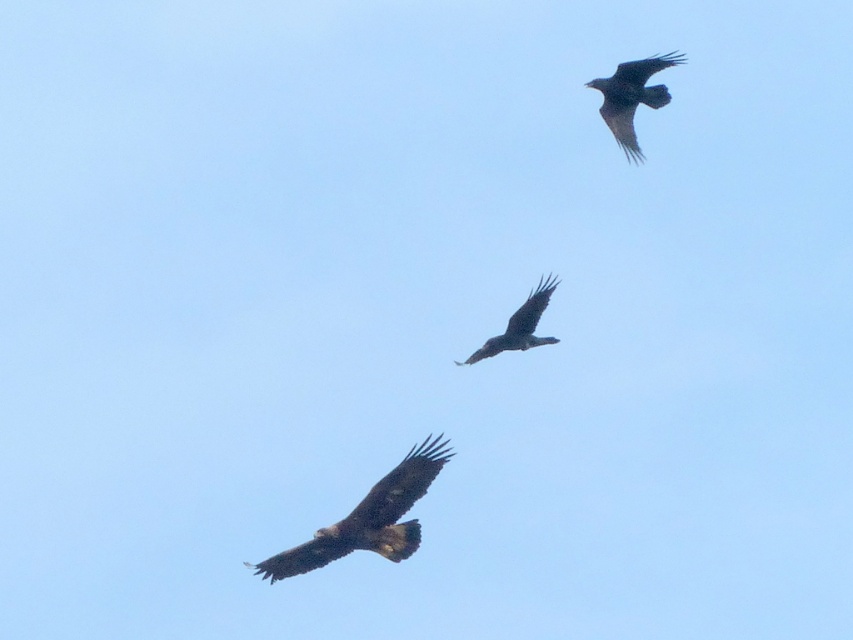
Between point (608, 83) and point (547, 284), which one is positioned behind?

Point (608, 83)

Is dark brown feathers at upper right closer to camera compared to dark brown feathers at center?

No, dark brown feathers at upper right is behind dark brown feathers at center.

At what (x,y) coordinates should I click in order to perform the action: click on dark brown feathers at upper right. Please return your answer as a coordinate pair (x, y). This screenshot has width=853, height=640. Looking at the image, I should click on (631, 97).

Measure the distance between point (312, 563) and camera.

Point (312, 563) and camera are 38.41 meters apart from each other.

Can you confirm if brown feathered eagle at lower center is shorter than dark brown feathers at upper right?

Incorrect, brown feathered eagle at lower center's height does not fall short of dark brown feathers at upper right's.

The image size is (853, 640). What do you see at coordinates (368, 518) in the screenshot?
I see `brown feathered eagle at lower center` at bounding box center [368, 518].

The image size is (853, 640). Identify the location of brown feathered eagle at lower center. (368, 518).

Is brown feathered eagle at lower center taller than dark brown feathers at center?

Yes.

What do you see at coordinates (368, 518) in the screenshot? This screenshot has width=853, height=640. I see `brown feathered eagle at lower center` at bounding box center [368, 518].

Image resolution: width=853 pixels, height=640 pixels. I want to click on brown feathered eagle at lower center, so click(x=368, y=518).